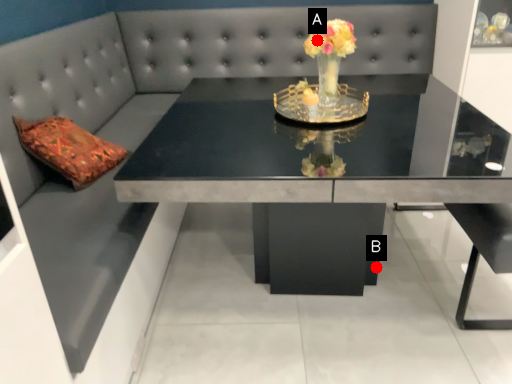
Question: Two points are circled on the image, labeled by A and B beside each circle. Which of the following is the farthest from the observer?

Choices:
 (A) A is further
 (B) B is further

Answer: (B)